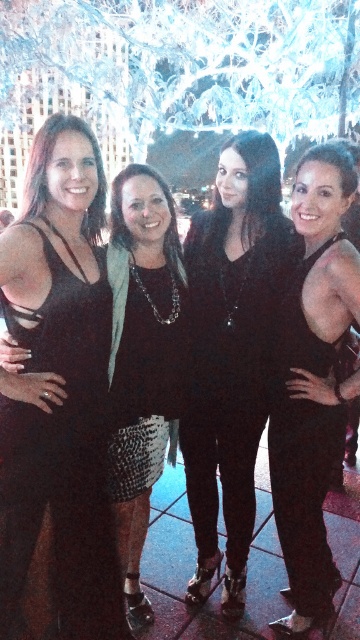
Which is in front, point (212, 449) or point (300, 518)?

Point (300, 518) is in front.

Which is more to the right, black leather dress at center or black matte dress at center?

black matte dress at center

What do you see at coordinates (231, 353) in the screenshot? I see `black leather dress at center` at bounding box center [231, 353].

At what (x,y) coordinates should I click in order to perform the action: click on black leather dress at center. Please return your answer as a coordinate pair (x, y). This screenshot has width=360, height=640. Looking at the image, I should click on (x=231, y=353).

Is point (240, 204) positioned behind point (173, 228)?

That is True.

Between black leather dress at center and black textured dress at left, which one appears on the left side from the viewer's perspective?

black textured dress at left

Locate an element on the screen. Image resolution: width=360 pixels, height=640 pixels. black leather dress at center is located at coordinates (231, 353).

Who is positioned more to the left, black matte dress at center or black textured dress at left?

black textured dress at left is more to the left.

Is point (322, 332) in front of point (111, 196)?

Yes, it is in front of point (111, 196).

Where is `black matte dress at center`? black matte dress at center is located at coordinates (313, 381).